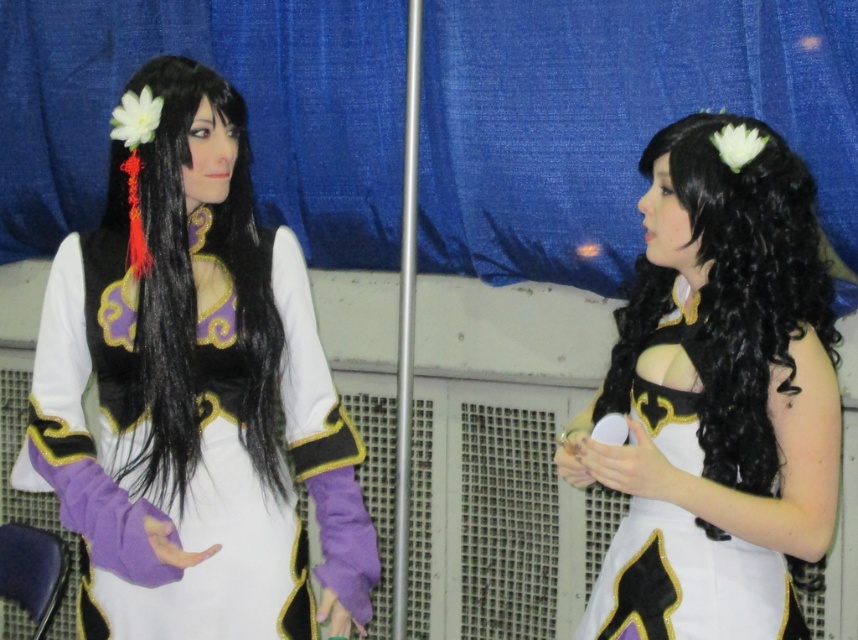
Question: Is matte black dress at center to the right of white matte dress at center from the viewer's perspective?

Choices:
 (A) yes
 (B) no

Answer: (B)

Question: Does matte black dress at center appear under white matte dress at center?

Choices:
 (A) yes
 (B) no

Answer: (B)

Question: Which object is the farthest from the white matte dress at center?

Choices:
 (A) black silky hair at left
 (B) matte black dress at center

Answer: (A)

Question: Is matte black dress at center to the right of black silky hair at left from the viewer's perspective?

Choices:
 (A) yes
 (B) no

Answer: (B)

Question: Which point appears closest to the camera in this image?

Choices:
 (A) (64, 323)
 (B) (158, 237)

Answer: (B)

Question: Which of the following is the closest to the observer?

Choices:
 (A) matte black dress at center
 (B) black silky hair at left

Answer: (A)